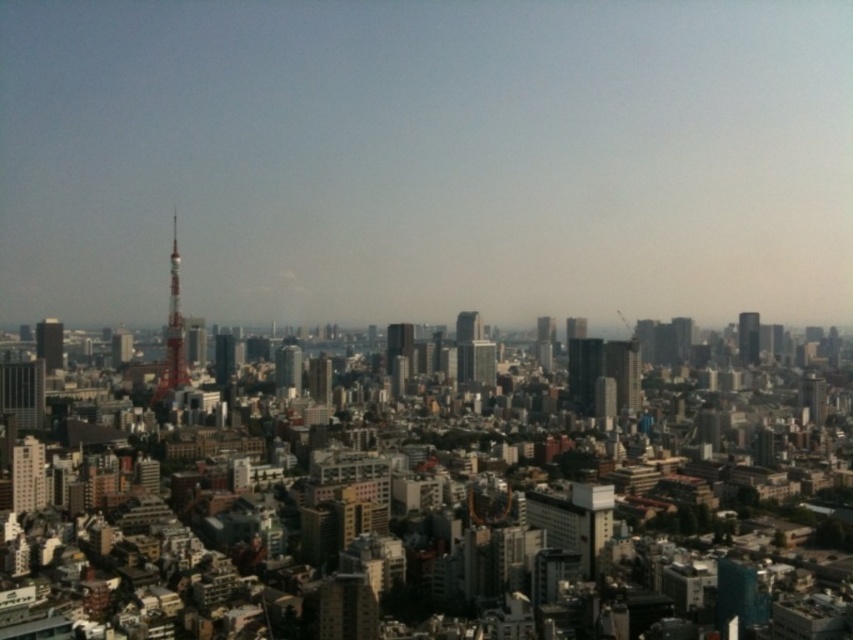
Question: Is red metallic tower at left to the right of glassy reflective skyscraper at center-right from the viewer's perspective?

Choices:
 (A) no
 (B) yes

Answer: (A)

Question: Which object is positioned farthest from the reddish metallic tower at left?

Choices:
 (A) red metallic tower at left
 (B) glassy reflective skyscraper at center-right
 (C) white glossy building at lower left

Answer: (B)

Question: Is glassy reflective skyscraper at center-right closer to camera compared to smooth glass skyscraper at center?

Choices:
 (A) no
 (B) yes

Answer: (B)

Question: Which point appears closest to the camera in this image?

Choices:
 (A) (282, 372)
 (B) (178, 324)
 (C) (569, 385)

Answer: (C)

Question: Can you confirm if glassy reflective skyscraper at center-right is wider than shiny glass skyscraper at right?

Choices:
 (A) yes
 (B) no

Answer: (B)

Question: Considering the real-world distances, which object is closest to the shiny glass skyscraper at right?

Choices:
 (A) smooth glass skyscraper at center
 (B) white glossy building at lower left

Answer: (A)